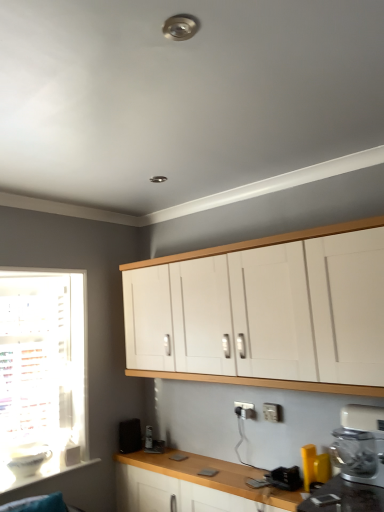
Question: Is white plastic electric outlet at lower center positioned with its back to yellow plastic spatula at lower right, which appears as the 3th appliance when viewed from the back?

Choices:
 (A) yes
 (B) no

Answer: (B)

Question: Could you tell me if white plastic electric outlet at lower center is facing yellow plastic spatula at lower right, which ranks as the third appliance in left-to-right order?

Choices:
 (A) yes
 (B) no

Answer: (B)

Question: From the image's perspective, would you say white plastic electric outlet at lower center is shown under yellow plastic spatula at lower right, which appears as the 3th appliance when viewed from the back?

Choices:
 (A) yes
 (B) no

Answer: (B)

Question: Is white plastic electric outlet at lower center thinner than yellow plastic spatula at lower right, which appears as the 3th appliance when viewed from the back?

Choices:
 (A) no
 (B) yes

Answer: (B)

Question: Is white plastic electric outlet at lower center to the left of yellow plastic spatula at lower right, which ranks as the third appliance in left-to-right order, from the viewer's perspective?

Choices:
 (A) yes
 (B) no

Answer: (A)

Question: Choose the correct answer: Is white glossy bowl at lower left, which is the third appliance from front to back, inside white plastic electric outlet at lower center or outside it?

Choices:
 (A) inside
 (B) outside

Answer: (B)

Question: In the image, is white glossy bowl at lower left, the 3th appliance from the right, positioned in front of or behind white plastic electric outlet at lower center?

Choices:
 (A) front
 (B) behind

Answer: (A)

Question: Is point (46, 458) positioned closer to the camera than point (264, 410)?

Choices:
 (A) closer
 (B) farther

Answer: (B)

Question: Is white glossy bowl at lower left, which appears as the first appliance when viewed from the left, bigger or smaller than white plastic electric outlet at lower center?

Choices:
 (A) small
 (B) big

Answer: (B)

Question: In terms of size, does white plastic electric outlet at lower center appear bigger or smaller than white plastic window sill at lower left?

Choices:
 (A) small
 (B) big

Answer: (A)

Question: Is point (276, 408) positioned closer to the camera than point (26, 479)?

Choices:
 (A) farther
 (B) closer

Answer: (B)

Question: Is white plastic electric outlet at lower center inside the boundaries of white plastic window sill at lower left, or outside?

Choices:
 (A) outside
 (B) inside

Answer: (A)

Question: Visually, is white plastic electric outlet at lower center positioned to the left or to the right of white plastic window sill at lower left?

Choices:
 (A) left
 (B) right

Answer: (B)

Question: Is point (92, 458) closer or farther from the camera than point (251, 507)?

Choices:
 (A) farther
 (B) closer

Answer: (A)

Question: Considering the positions of white plastic window sill at lower left and wooden at lower center in the image, is white plastic window sill at lower left taller or shorter than wooden at lower center?

Choices:
 (A) short
 (B) tall

Answer: (A)